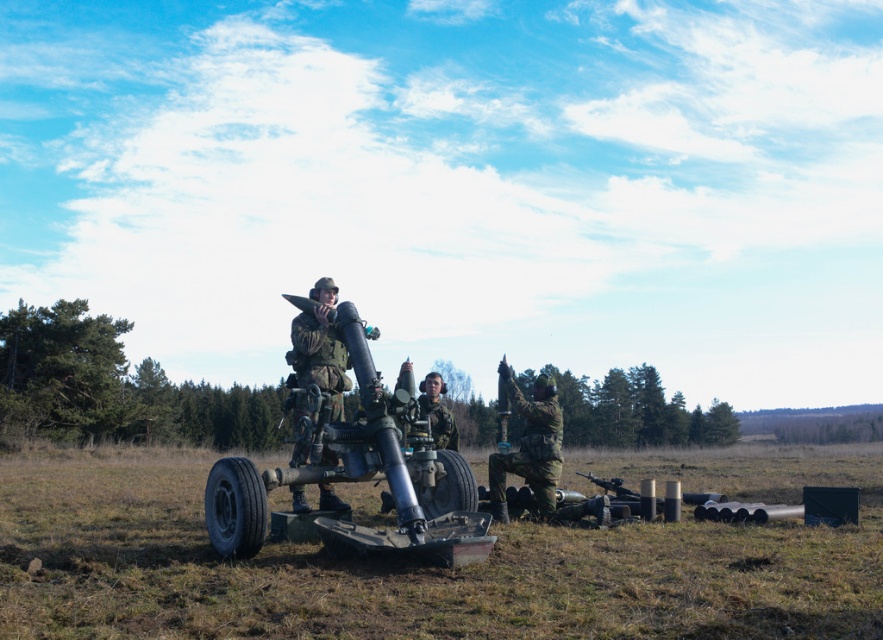
Who is positioned more to the right, matte green tank at center or camouflage fabric uniform at center?

From the viewer's perspective, matte green tank at center appears more on the right side.

Does matte green tank at center have a lesser width compared to camouflage fabric uniform at center?

In fact, matte green tank at center might be wider than camouflage fabric uniform at center.

Where is `matte green tank at center`? Image resolution: width=883 pixels, height=640 pixels. matte green tank at center is located at coordinates (357, 476).

Where is `matte green tank at center`? The height and width of the screenshot is (640, 883). matte green tank at center is located at coordinates (357, 476).

Who is positioned more to the left, matte green tank at center or matte black rifle at center?

From the viewer's perspective, matte green tank at center appears more on the left side.

In order to click on matte green tank at center in this screenshot , I will do `click(357, 476)`.

Is point (421, 404) farther from camera compared to point (506, 422)?

Yes, point (421, 404) is farther from viewer.

Is camouflage fabric helmet at center closer to the viewer compared to matte black rifle at center?

Yes, it is in front of matte black rifle at center.

Which is behind, point (438, 400) or point (500, 444)?

The point (438, 400) is behind.

At what (x,y) coordinates should I click in order to perform the action: click on camouflage fabric helmet at center. Please return your answer as a coordinate pair (x, y). This screenshot has width=883, height=640. Looking at the image, I should click on (436, 412).